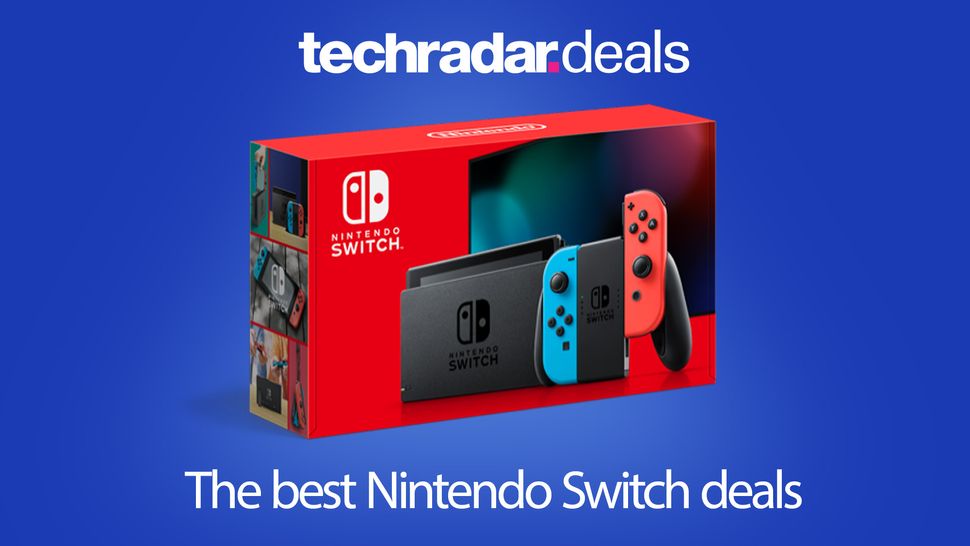
In order to click on switch in this screenshot , I will do pyautogui.click(x=582, y=272).